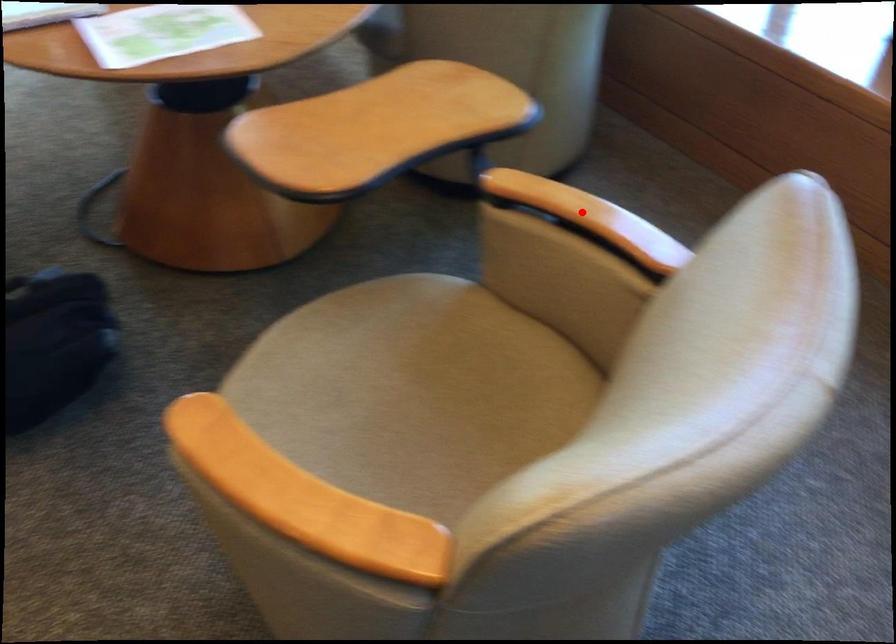
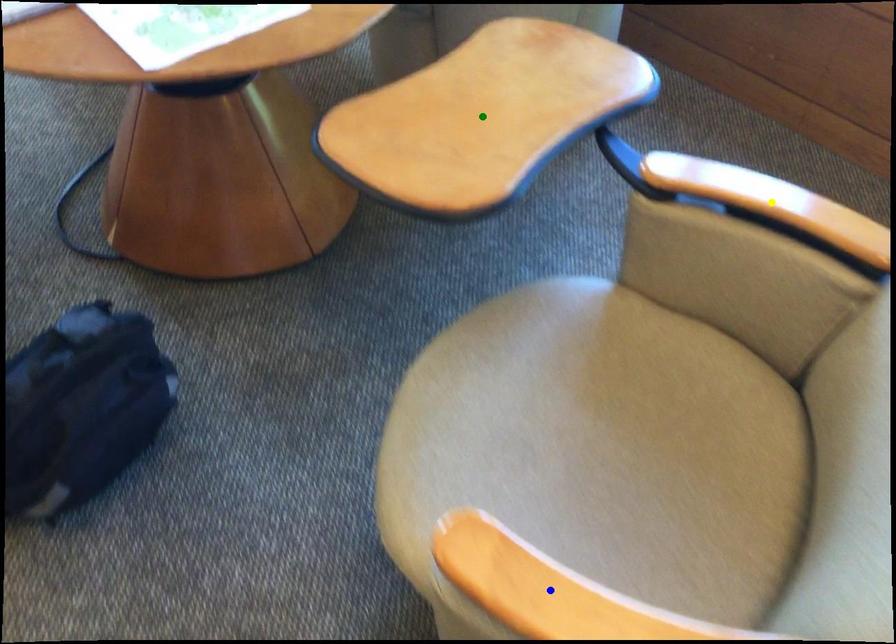
Question: I am providing you with two images of the same scene from different viewpoints. A red point is marked on the first image. You are given multiple points on the second image. Which mark in image 2 goes with the point in image 1?

Choices:
 (A) yellow point
 (B) blue point
 (C) green point

Answer: (A)